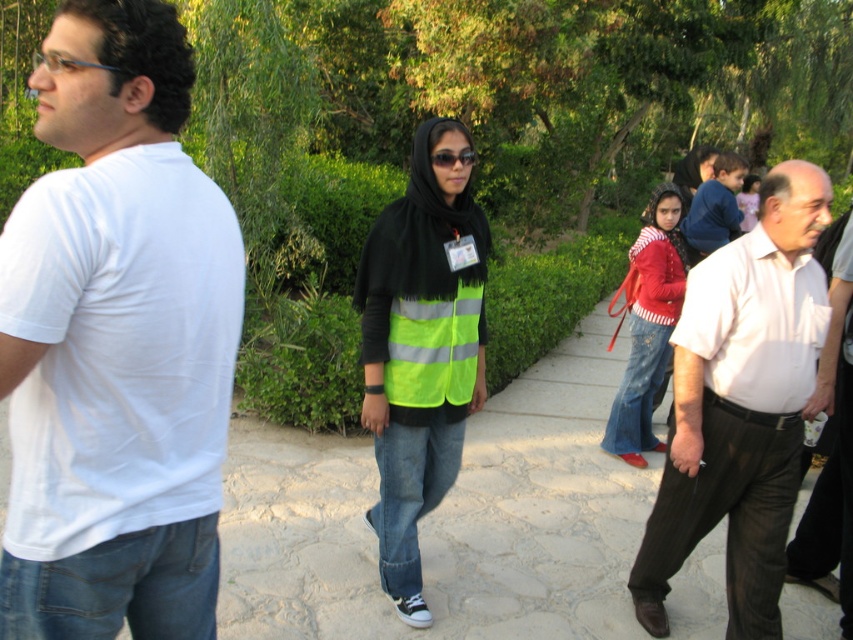
You are a photographer standing at the camera position. You want to take a photo of the white cotton shirt at center. Can you reach it with your camera lens? The camera has a 100mm lens with a 1.4x teleconverter, which effectively makes the focal length 140mm. The minimum focusing distance of the camera is 10 feet.

The white cotton shirt at center is 9.92 feet away from the camera. Since the minimum focusing distance of the camera is 10 feet, the camera cannot focus on the subject because it is too close. Therefore, you cannot take the photo with the current setup.

You are a pedestrian trying to cross the pathway. There are two people in front of you wearing a neon yellow reflective vest at center and a red striped sweater at center. Which one should you avoid bumping into if you move to the right?

You should avoid bumping into the red striped sweater at center because the neon yellow reflective vest at center is to the left of it. Moving to the right would bring you closer to the red striped sweater at center.

You are a photographer trying to capture both the white cotton shirt at center and the neon yellow reflective vest at center in a single shot. Which object should you focus on first if you want to ensure both are in focus, considering their sizes?

The white cotton shirt at center is larger in size compared to the neon yellow reflective vest at center. To ensure both are in focus, you should focus on the white cotton shirt at center first, as larger objects often require more precise focus adjustments.